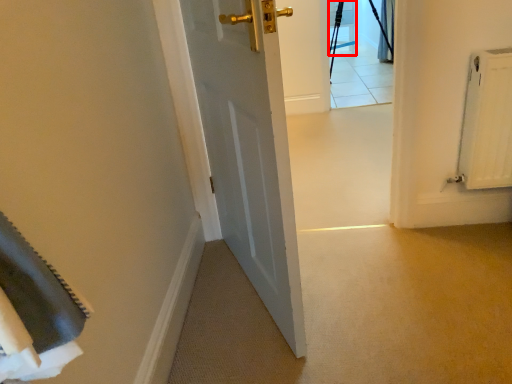
Question: From the image's perspective, where is chair (annotated by the red box) located in relation to curtain in the image?

Choices:
 (A) above
 (B) below

Answer: (A)